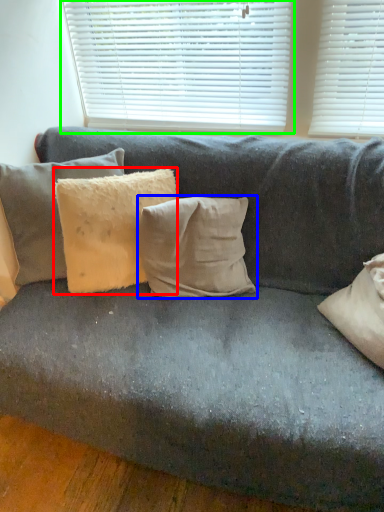
Question: Considering the real-world distances, which object is farthest from pillow (highlighted by a red box)? pillow (highlighted by a blue box) or window blind (highlighted by a green box)?

Choices:
 (A) pillow
 (B) window blind

Answer: (B)